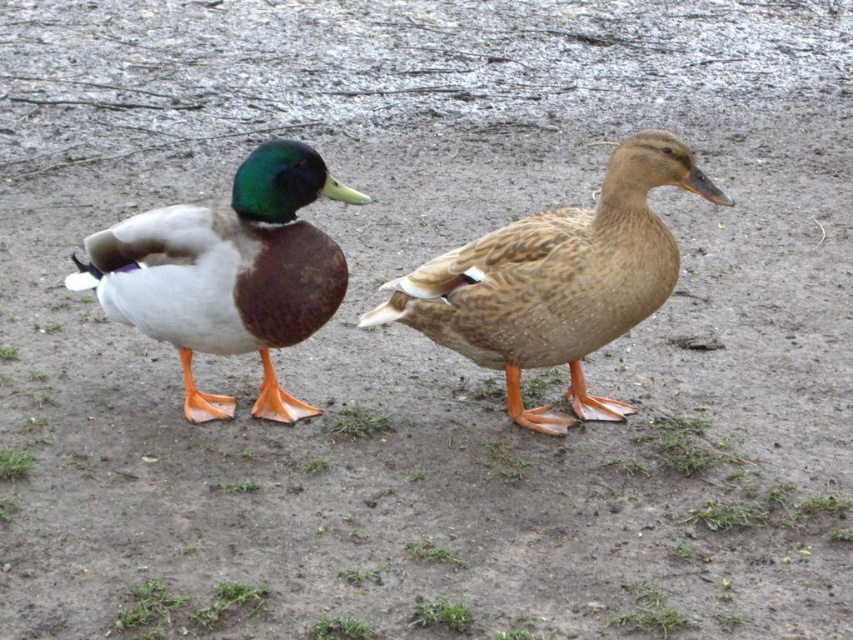
Question: Among these points, which one is farthest from the camera?

Choices:
 (A) (567, 282)
 (B) (80, 273)

Answer: (B)

Question: Among these points, which one is farthest from the camera?

Choices:
 (A) (601, 298)
 (B) (332, 291)

Answer: (B)

Question: Does brown feathered duck at center lie in front of matte brown duck at left?

Choices:
 (A) yes
 (B) no

Answer: (A)

Question: Is brown feathered duck at center thinner than matte brown duck at left?

Choices:
 (A) yes
 (B) no

Answer: (B)

Question: Does brown feathered duck at center appear under matte brown duck at left?

Choices:
 (A) yes
 (B) no

Answer: (A)